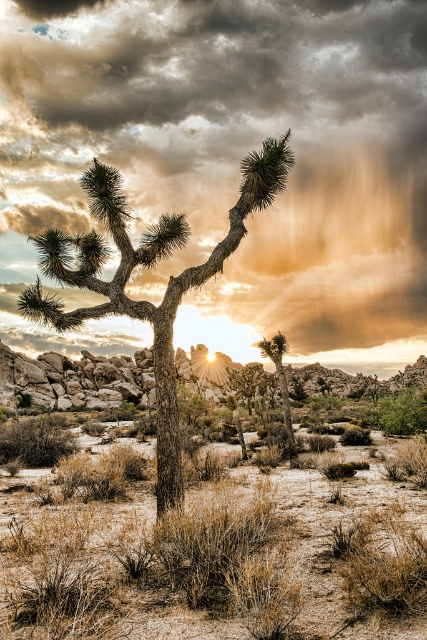
Question: Does cloudy sky at upper center lie in front of green leafy tree at center?

Choices:
 (A) yes
 (B) no

Answer: (A)

Question: Among these objects, which one is farthest from the camera?

Choices:
 (A) matte brown joshua tree at center
 (B) green leafy tree at center

Answer: (B)

Question: Does cloudy sky at upper center appear over matte brown joshua tree at center?

Choices:
 (A) yes
 (B) no

Answer: (A)

Question: Which point is closer to the camera?

Choices:
 (A) matte brown joshua tree at center
 (B) green leafy tree at center
 (C) cloudy sky at upper center

Answer: (A)

Question: Which of the following is the farthest from the observer?

Choices:
 (A) green leafy tree at center
 (B) matte brown joshua tree at center

Answer: (A)

Question: Can you confirm if cloudy sky at upper center is positioned to the left of matte brown joshua tree at center?

Choices:
 (A) no
 (B) yes

Answer: (A)